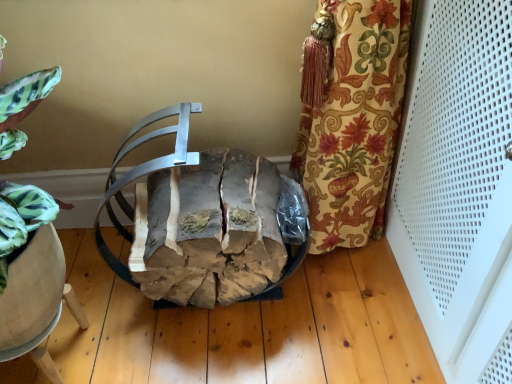
Question: From the image's perspective, is rustic wood log at center above or below wooden chair at lower left?

Choices:
 (A) above
 (B) below

Answer: (A)

Question: Considering their positions, is rustic wood log at center located in front of or behind wooden chair at lower left?

Choices:
 (A) front
 (B) behind

Answer: (A)

Question: Is rustic wood log at center spatially inside wooden chair at lower left, or outside of it?

Choices:
 (A) outside
 (B) inside

Answer: (A)

Question: Considering the positions of point (53, 370) and point (266, 256), is point (53, 370) closer or farther from the camera than point (266, 256)?

Choices:
 (A) farther
 (B) closer

Answer: (B)

Question: Considering the relative positions of wooden chair at lower left and rustic wood log at center in the image provided, is wooden chair at lower left to the left or to the right of rustic wood log at center?

Choices:
 (A) left
 (B) right

Answer: (A)

Question: From the image's perspective, is wooden chair at lower left above or below rustic wood log at center?

Choices:
 (A) above
 (B) below

Answer: (B)

Question: Considering the positions of wooden chair at lower left and rustic wood log at center in the image, is wooden chair at lower left bigger or smaller than rustic wood log at center?

Choices:
 (A) small
 (B) big

Answer: (A)